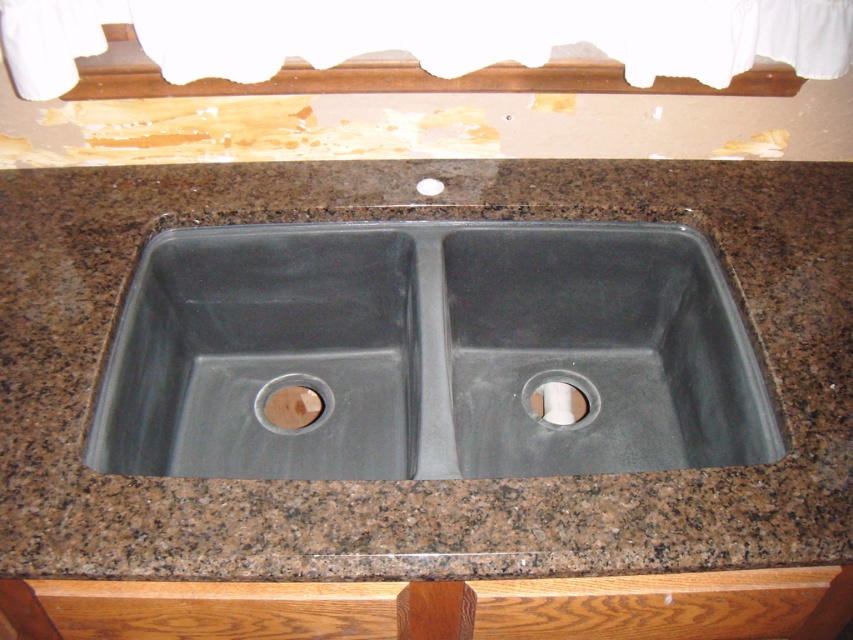
Question: Among these objects, which one is farthest from the camera?

Choices:
 (A) gray matte sink at center
 (B) wooden circular drain at center
 (C) matte gray drain at center

Answer: (B)

Question: Is matte gray drain at center closer to the viewer compared to wooden circular drain at center?

Choices:
 (A) yes
 (B) no

Answer: (A)

Question: Can you confirm if matte gray drain at center is wider than wooden circular drain at center?

Choices:
 (A) yes
 (B) no

Answer: (B)

Question: Which object appears closest to the camera in this image?

Choices:
 (A) matte gray drain at center
 (B) gray matte sink at center

Answer: (B)

Question: Can you confirm if matte gray drain at center is positioned above wooden circular drain at center?

Choices:
 (A) no
 (B) yes

Answer: (B)

Question: Estimate the real-world distances between objects in this image. Which object is closer to the wooden circular drain at center?

Choices:
 (A) gray matte sink at center
 (B) matte gray drain at center

Answer: (A)